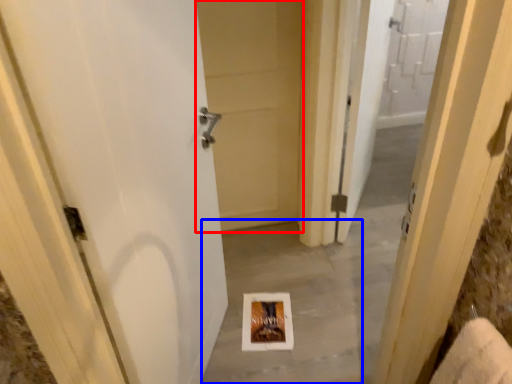
Question: Which of the following is the closest to the observer, door (highlighted by a red box) or concrete (highlighted by a blue box)?

Choices:
 (A) door
 (B) concrete

Answer: (B)